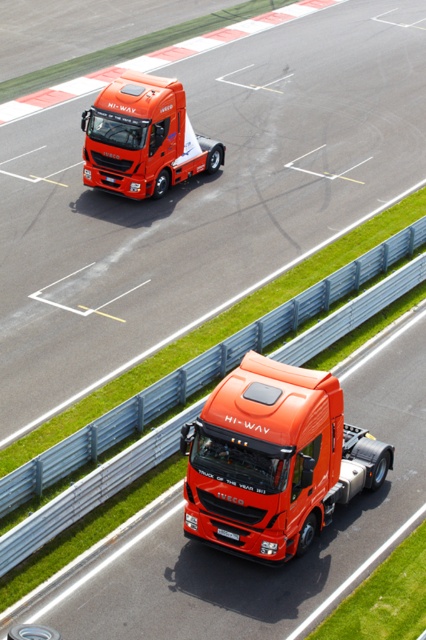
You are a race official observing the shiny orange truck at center and the black plastic license plate at center during a race. Which object is positioned higher in the image?

The shiny orange truck at center is positioned above the black plastic license plate at center, so it is higher in the image.